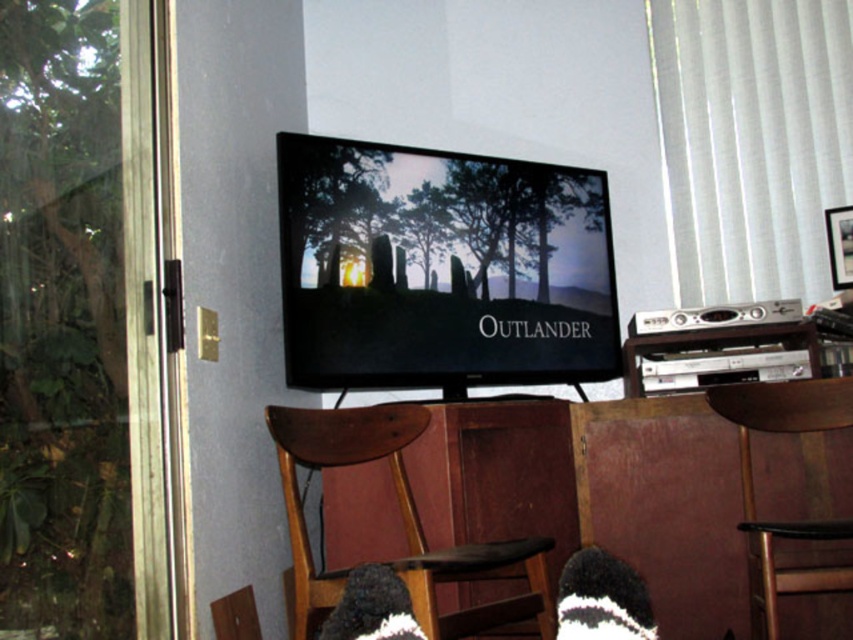
You are trying to decide which door to use to exit the room. Both the transparent glass door at left and the clear glass screen door at left are available. Which one is bigger and therefore easier to walk through?

The transparent glass door at left is larger in size than the clear glass screen door at left, so it is easier to walk through.

You are standing in the room and want to open the clear glass screen door at left. However, there is a black knitted sock at lower center in the way. Can you step over the sock to reach the door?

The clear glass screen door at left is located above the black knitted sock at lower center, so yes, you can step over the sock to reach the door.

You are standing in the room and want to determine which point is closer to you. The points are labeled as point 1 at coordinates (131, 8) and point 2 at coordinates (587, 547). Based on the scene, which point is closer to your position?

Point 1 at coordinates (131, 8) is closer to you because it is further to the viewer than point 2 at coordinates (587, 547).